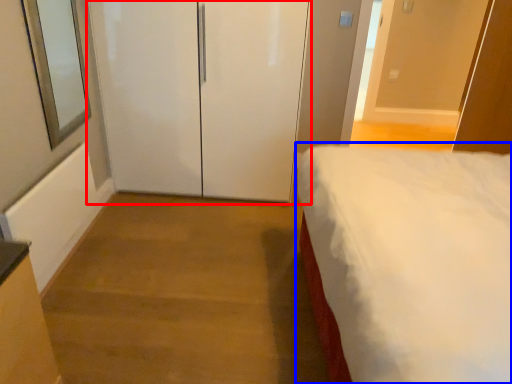
Question: Which object appears farthest to the camera in this image, door (highlighted by a red box) or bed (highlighted by a blue box)?

Choices:
 (A) door
 (B) bed

Answer: (A)